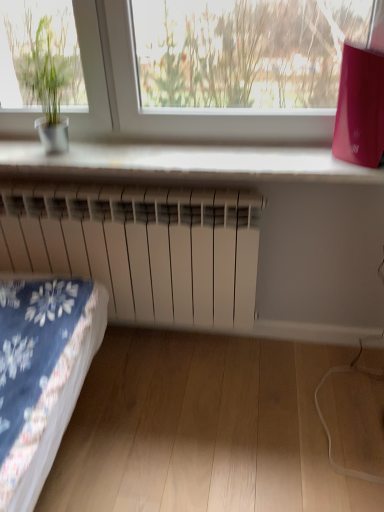
Question: Is green matte plant pot at left shorter than white matte radiator at center?

Choices:
 (A) no
 (B) yes

Answer: (B)

Question: From a real-world perspective, does green matte plant pot at left sit lower than white matte radiator at center?

Choices:
 (A) yes
 (B) no

Answer: (B)

Question: Does green matte plant pot at left appear on the right side of white matte radiator at center?

Choices:
 (A) no
 (B) yes

Answer: (A)

Question: Is green matte plant pot at left oriented away from white matte radiator at center?

Choices:
 (A) yes
 (B) no

Answer: (B)

Question: Would you say green matte plant pot at left contains white matte radiator at center?

Choices:
 (A) yes
 (B) no

Answer: (B)

Question: Are green matte plant pot at left and white matte radiator at center located far from each other?

Choices:
 (A) yes
 (B) no

Answer: (B)

Question: Considering the relative sizes of white plastic radiator at lower center and green matte plant pot at left in the image provided, is white plastic radiator at lower center bigger than green matte plant pot at left?

Choices:
 (A) no
 (B) yes

Answer: (B)

Question: From a real-world perspective, is white plastic radiator at lower center beneath green matte plant pot at left?

Choices:
 (A) no
 (B) yes

Answer: (B)

Question: Is white plastic radiator at lower center located outside green matte plant pot at left?

Choices:
 (A) yes
 (B) no

Answer: (A)

Question: From the image's perspective, is white plastic radiator at lower center located above green matte plant pot at left?

Choices:
 (A) no
 (B) yes

Answer: (A)

Question: Is white plastic radiator at lower center to the left of green matte plant pot at left from the viewer's perspective?

Choices:
 (A) yes
 (B) no

Answer: (B)

Question: Is white plastic radiator at lower center turned away from green matte plant pot at left?

Choices:
 (A) no
 (B) yes

Answer: (A)

Question: Considering the relative sizes of white plastic radiator at lower center and white matte radiator at center in the image provided, is white plastic radiator at lower center bigger than white matte radiator at center?

Choices:
 (A) no
 (B) yes

Answer: (A)